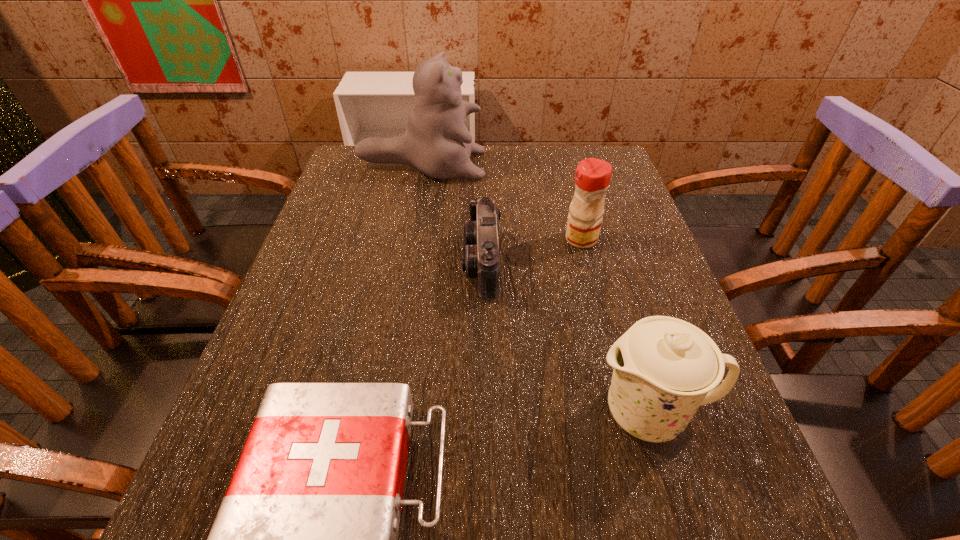
Identify the location of object that stands as the second closest to the camcorder. Image resolution: width=960 pixels, height=540 pixels. (436, 142).

Locate an element on the screen. The width and height of the screenshot is (960, 540). vacant position in the image that satisfies the following two spatial constraints: 1. on the face of the condiment; 2. on the right side of the cat is located at coordinates (408, 239).